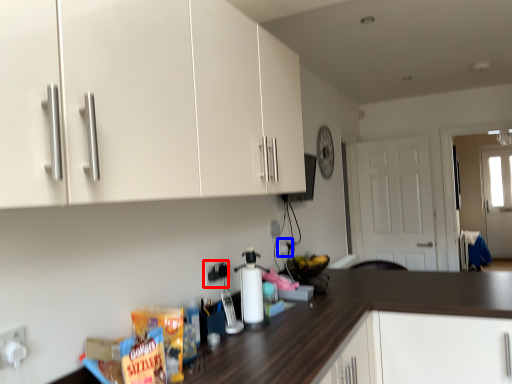
Question: Which object appears closest to the camera in this image, electric outlet (highlighted by a red box) or electric outlet (highlighted by a blue box)?

Choices:
 (A) electric outlet
 (B) electric outlet

Answer: (A)